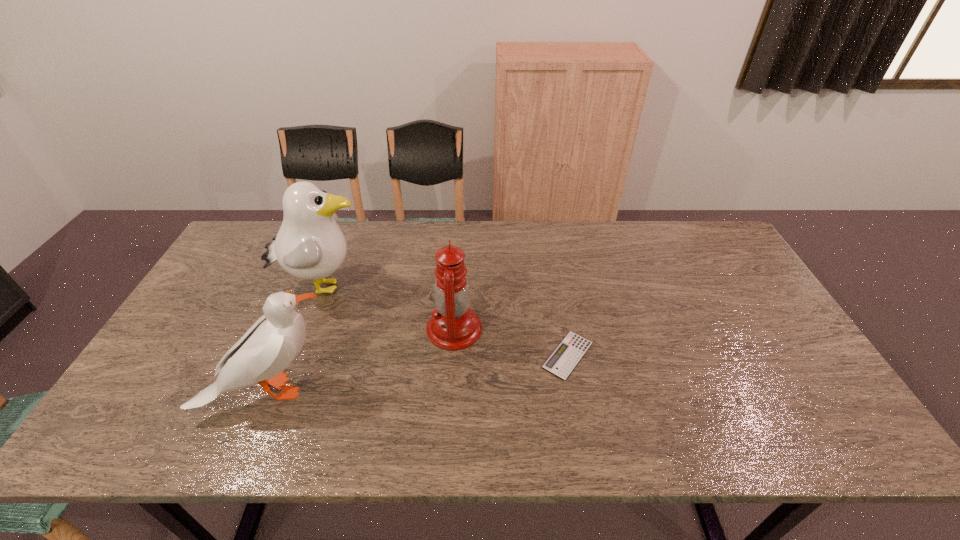
Locate an element on the screen. object that is positioned at the near edge is located at coordinates (270, 345).

The image size is (960, 540). I want to click on vacant space at the far edge of the desktop, so click(390, 227).

At what (x,y) coordinates should I click in order to perform the action: click on blank area at the near edge. Please return your answer as a coordinate pair (x, y). This screenshot has height=540, width=960. Looking at the image, I should click on (598, 443).

Where is `free region at the left edge`? This screenshot has height=540, width=960. free region at the left edge is located at coordinates (244, 273).

Find the location of a particular element. free space at the right edge is located at coordinates pos(701,281).

Find the location of a particular element. free space at the far left corner is located at coordinates (258, 252).

I want to click on vacant area at the far right corner, so click(x=706, y=232).

At what (x,y) coordinates should I click in order to perform the action: click on vacant space in between the calculator and the third object from left to right. Please return your answer as a coordinate pair (x, y). Looking at the image, I should click on (511, 342).

Identify the location of free space between the calculator and the oil lamp. [x=511, y=342].

At what (x,y) coordinates should I click in order to perform the action: click on free spot between the third object from left to right and the calculator. Please return your answer as a coordinate pair (x, y). Looking at the image, I should click on (511, 342).